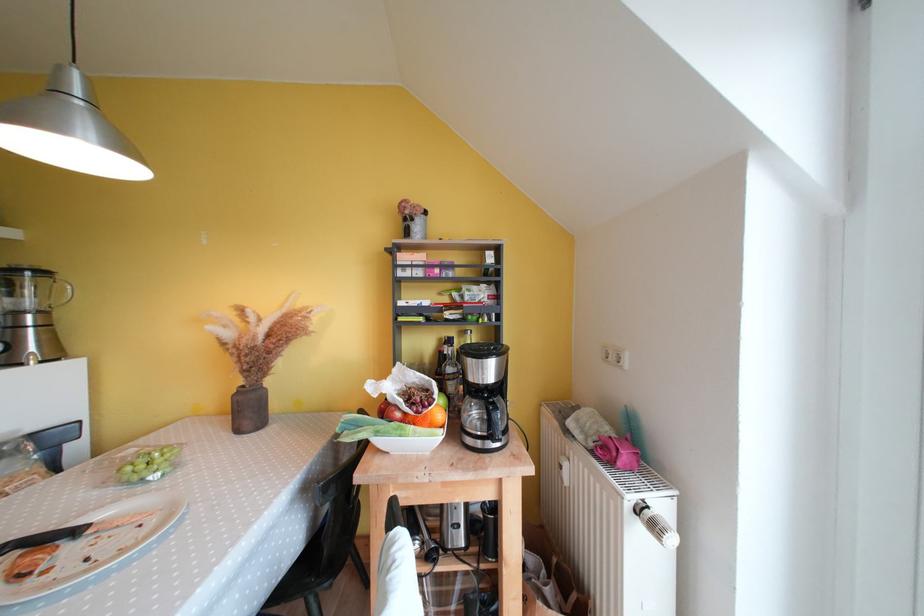
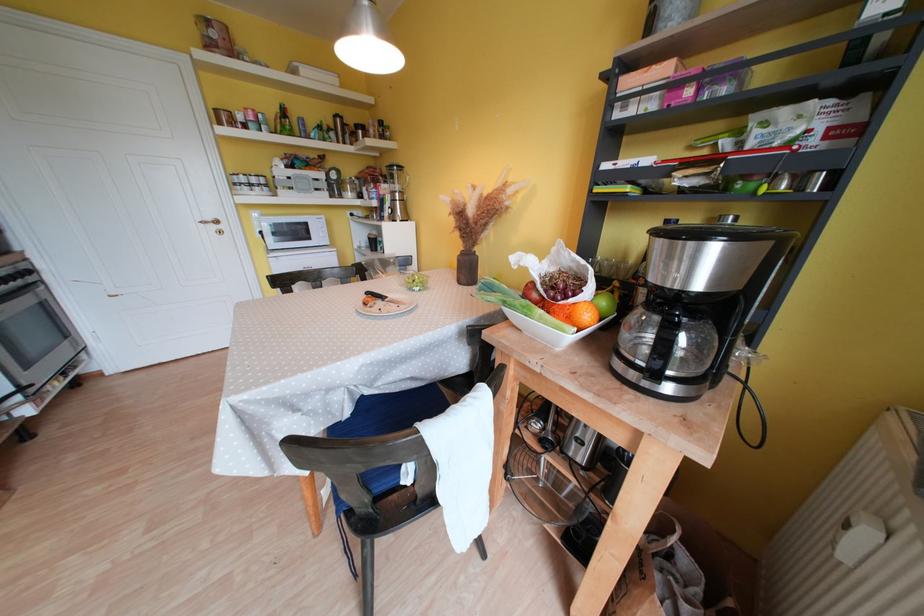
Where in the second image is the point corresponding to the point at 480,405 from the first image?

(663, 322)